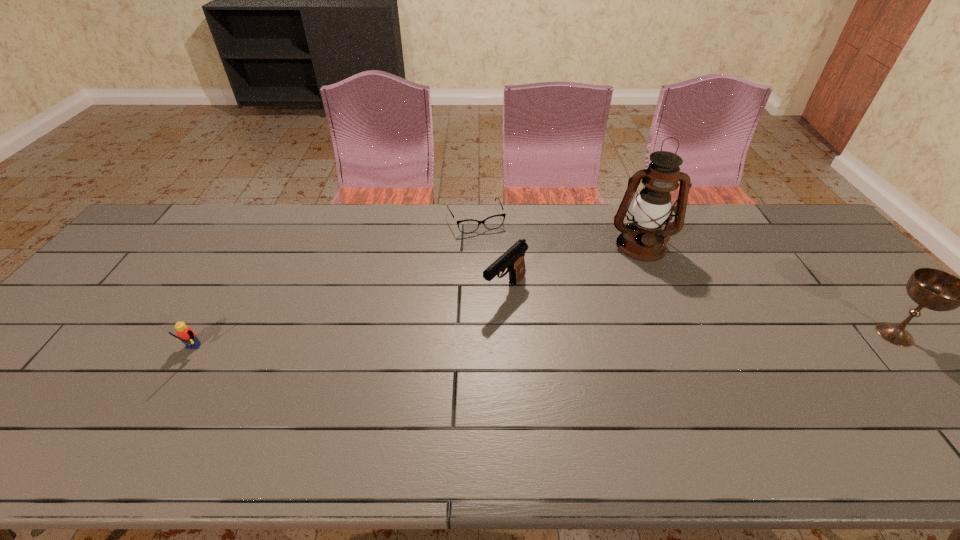
Identify the location of blank area located 0.090m on the left of the rightmost object. Image resolution: width=960 pixels, height=540 pixels. (838, 334).

At what (x,y) coordinates should I click in order to perform the action: click on free location located 0.320m on the side of the fourth object from left to right, there is a wick adjustment knob. Please return your answer as a coordinate pair (x, y). The width and height of the screenshot is (960, 540). Looking at the image, I should click on (653, 343).

You are a GUI agent. You are given a task and a screenshot of the screen. Output one action in this format:
    pyautogui.click(x=<x>, y=<y>)
    Task: Click on the vacant space located 0.080m on the side of the fourth object from left to right, there is a wick adjustment knob
    
    Given the screenshot: What is the action you would take?
    644,279

At what (x,y) coordinates should I click in order to perform the action: click on vacant position located 0.220m on the side of the fourth object from left to right, there is a wick adjustment knob. Please return your answer as a coordinate pair (x, y). This screenshot has height=540, width=960. Looking at the image, I should click on (649, 314).

The width and height of the screenshot is (960, 540). I want to click on vacant area situated on the front-facing side of the shortest object, so click(509, 291).

What are the coordinates of `vacant region located on the front-facing side of the shortest object` in the screenshot? It's located at (506, 284).

Where is `vacant region located 0.250m on the front-facing side of the shortest object`? Image resolution: width=960 pixels, height=540 pixels. vacant region located 0.250m on the front-facing side of the shortest object is located at coordinates (507, 286).

The image size is (960, 540). In order to click on free location located at the barrel of the pistol in this screenshot , I will do `click(410, 386)`.

The height and width of the screenshot is (540, 960). Identify the location of vacant space located 0.190m at the barrel of the pistol. (446, 350).

I want to click on free space located at the barrel of the pistol, so click(467, 330).